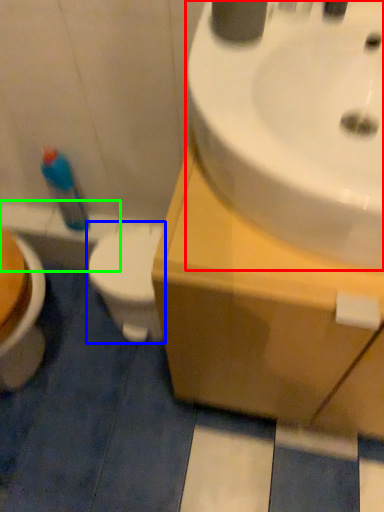
Question: Considering the real-world distances, which object is closest to sink (highlighted by a red box)? toilet (highlighted by a blue box) or bath (highlighted by a green box).

Choices:
 (A) toilet
 (B) bath

Answer: (A)